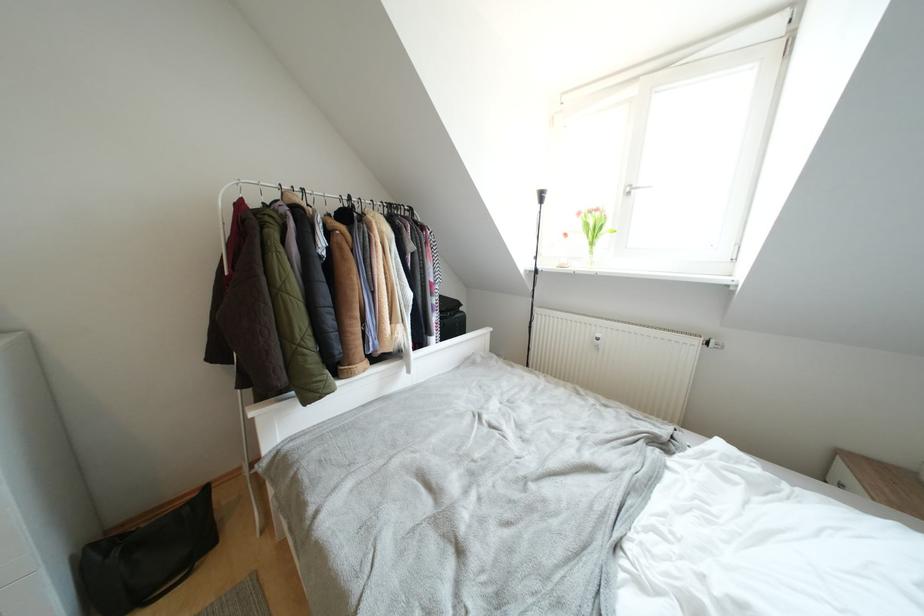
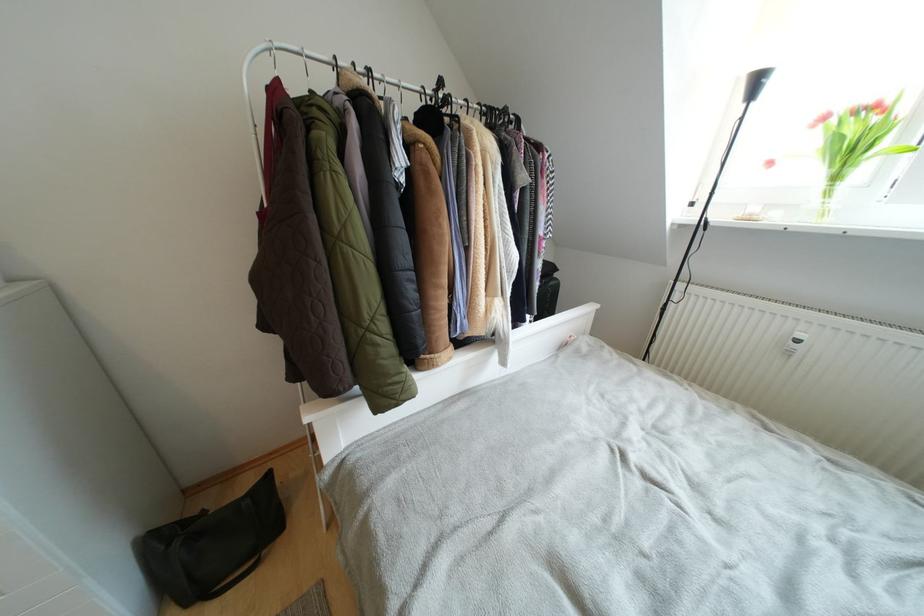
Question: The camera is either moving clockwise (left) or counter-clockwise (right) around the object. The first image is from the beginning of the video and the second image is from the end. Is the camera moving left or right when shooting the video?

Choices:
 (A) Left
 (B) Right

Answer: (B)